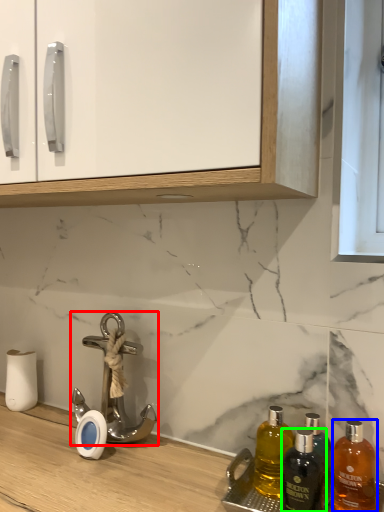
Question: Which object is positioned farthest from tap (highlighted by a red box)? Select from bottle (highlighted by a blue box) and bottle (highlighted by a green box).

Choices:
 (A) bottle
 (B) bottle

Answer: (A)